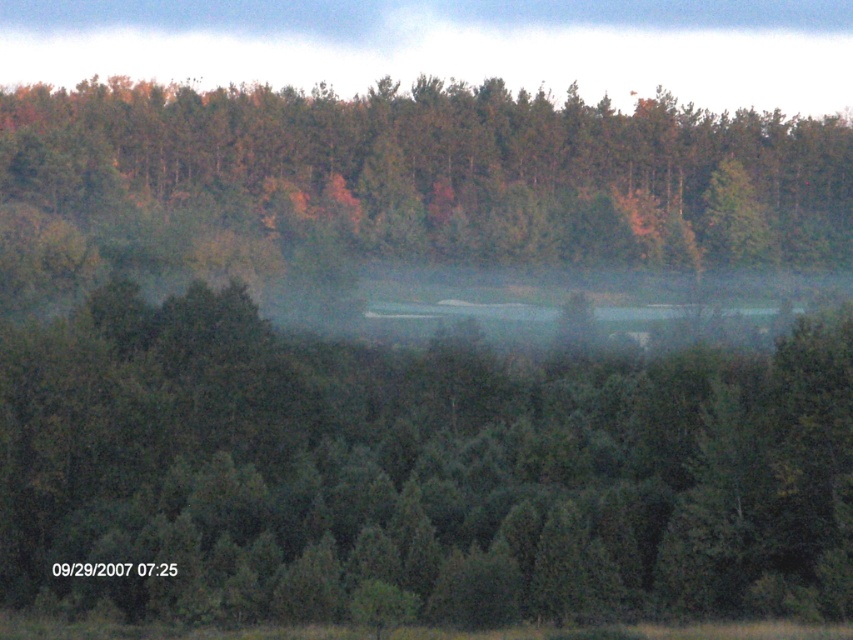
You are an observer standing in the forest looking at the scene. Can you see the top of the foggy mist at upper center behind the green matte tree at center?

The green matte tree at center is in front of the foggy mist at upper center, so the top of the foggy mist at upper center is partially or fully obscured by the green matte tree at center. Therefore, you cannot see the top of the foggy mist at upper center clearly behind the green matte tree at center.

You are a hiker standing in the forest and see the green matte tree at center and the green matte trees at upper center. Which group is closer to you?

The green matte tree at center is closer to you because it is positioned under the green matte trees at upper center, indicating it is in a lower, more foreground position.